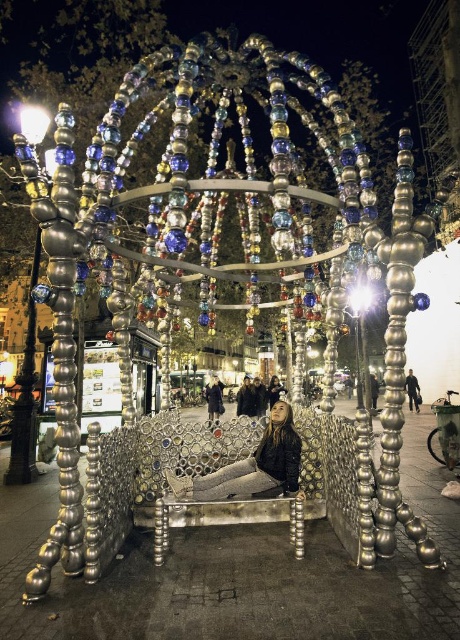
Question: Does silver metallic jacket at center appear on the right side of dark gray jacket at lower right?

Choices:
 (A) no
 (B) yes

Answer: (A)

Question: Which point is closer to the camera?

Choices:
 (A) dark gray jacket at lower right
 (B) dark blue fabric coat at center

Answer: (A)

Question: Which object is the farthest from the dark blue fabric coat at center?

Choices:
 (A) dark gray jacket at lower right
 (B) silver metallic jacket at center

Answer: (B)

Question: Which of the following is the closest to the observer?

Choices:
 (A) dark gray jacket at lower right
 (B) dark blue fabric coat at center
 (C) dark brown leather jacket at center
 (D) silver metallic jacket at center

Answer: (D)

Question: Is dark brown leather jacket at center in front of dark gray jacket at lower right?

Choices:
 (A) yes
 (B) no

Answer: (A)

Question: Can you confirm if dark blue fabric coat at center is positioned below dark brown leather jacket at center?

Choices:
 (A) yes
 (B) no

Answer: (A)